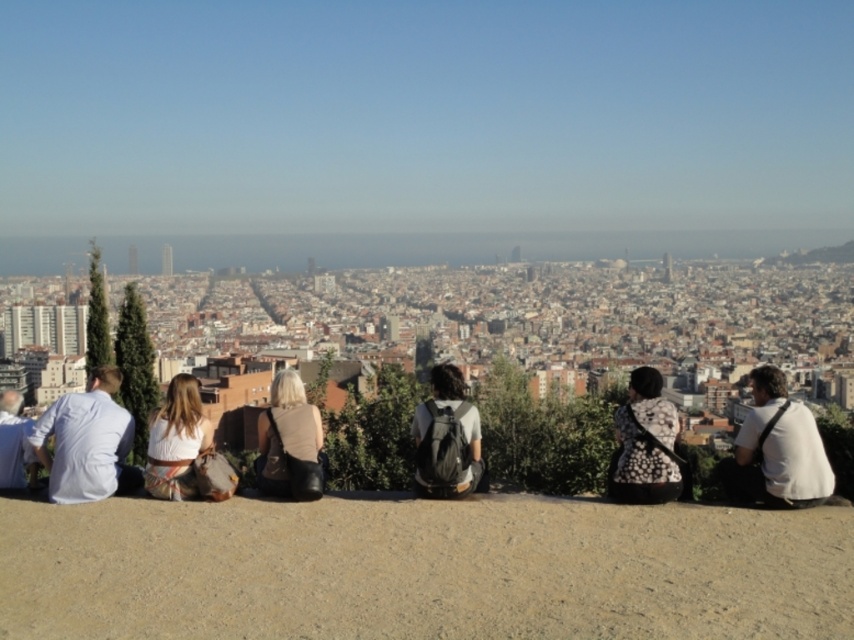
What do you see at coordinates (446, 438) in the screenshot?
I see `gray fabric backpack at center` at bounding box center [446, 438].

Who is taller, gray fabric backpack at center or white fabric dress at center?

gray fabric backpack at center is taller.

Which is in front, point (449, 410) or point (167, 428)?

Positioned in front is point (167, 428).

Image resolution: width=854 pixels, height=640 pixels. In order to click on gray fabric backpack at center in this screenshot , I will do `click(446, 438)`.

Describe the element at coordinates (290, 442) in the screenshot. I see `light beige fabric bag at center` at that location.

Is light beige fabric bag at center wider than light blue shirt at left?

No.

What do you see at coordinates (290, 442) in the screenshot? I see `light beige fabric bag at center` at bounding box center [290, 442].

At what (x,y) coordinates should I click in order to perform the action: click on light beige fabric bag at center. Please return your answer as a coordinate pair (x, y). The image size is (854, 640). Looking at the image, I should click on (290, 442).

Who is more distant from viewer, (825, 488) or (414, 424)?

The point (414, 424) is behind.

Does point (736, 465) lie in front of point (451, 488)?

No, (736, 465) is behind (451, 488).

Find the location of a particular element. The height and width of the screenshot is (640, 854). white cotton shirt at right is located at coordinates (776, 451).

The image size is (854, 640). In order to click on white cotton shirt at right in this screenshot , I will do `click(776, 451)`.